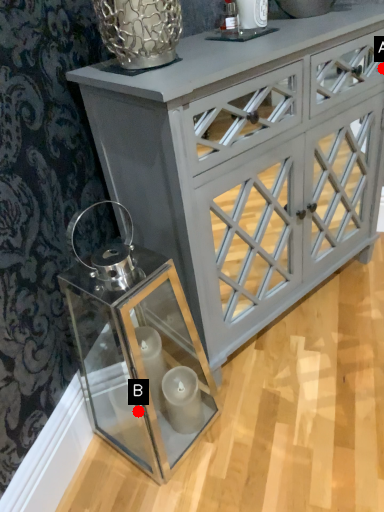
Question: Two points are circled on the image, labeled by A and B beside each circle. Which point appears farthest from the camera in this image?

Choices:
 (A) A is further
 (B) B is further

Answer: (A)